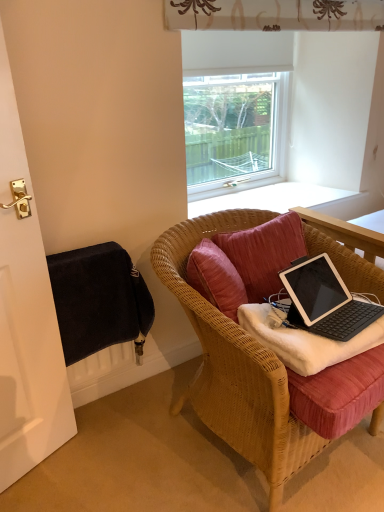
Question: From the image's perspective, is transparent glass window at upper center on black fabric radiator at lower left?

Choices:
 (A) yes
 (B) no

Answer: (A)

Question: Is transparent glass window at upper center outside of black fabric radiator at lower left?

Choices:
 (A) no
 (B) yes

Answer: (B)

Question: Could black fabric radiator at lower left be considered to be inside transparent glass window at upper center?

Choices:
 (A) no
 (B) yes

Answer: (A)

Question: Is transparent glass window at upper center smaller than black fabric radiator at lower left?

Choices:
 (A) no
 (B) yes

Answer: (A)

Question: Are transparent glass window at upper center and black fabric radiator at lower left located far from each other?

Choices:
 (A) no
 (B) yes

Answer: (B)

Question: Is point (322, 266) closer or farther from the camera than point (57, 290)?

Choices:
 (A) closer
 (B) farther

Answer: (A)

Question: From the image's perspective, is black matte laptop at center positioned above or below black fabric radiator at lower left?

Choices:
 (A) above
 (B) below

Answer: (A)

Question: Relative to black fabric radiator at lower left, is black matte laptop at center in front or behind?

Choices:
 (A) behind
 (B) front

Answer: (B)

Question: Do you think black matte laptop at center is within black fabric radiator at lower left, or outside of it?

Choices:
 (A) outside
 (B) inside

Answer: (A)

Question: In terms of height, does woven wood chair at center look taller or shorter compared to velvet-like pink pillow at center?

Choices:
 (A) short
 (B) tall

Answer: (B)

Question: From the image's perspective, is woven wood chair at center above or below velvet-like pink pillow at center?

Choices:
 (A) below
 (B) above

Answer: (A)

Question: Is point (228, 334) positioned closer to the camera than point (268, 252)?

Choices:
 (A) closer
 (B) farther

Answer: (A)

Question: Relative to velvet-like pink pillow at center, is woven wood chair at center in front or behind?

Choices:
 (A) front
 (B) behind

Answer: (A)

Question: Is black matte laptop at center wider or thinner than transparent glass window at upper center?

Choices:
 (A) thin
 (B) wide

Answer: (B)

Question: Is point (321, 276) positioned closer to the camera than point (193, 110)?

Choices:
 (A) farther
 (B) closer

Answer: (B)